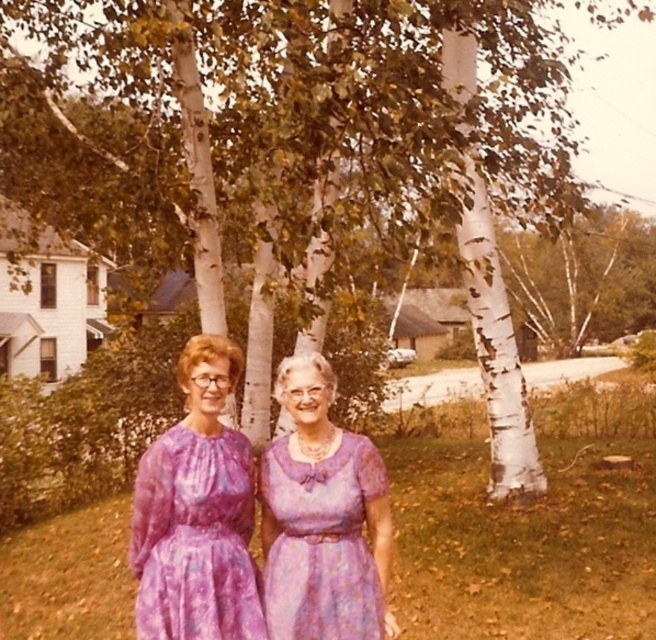
You are taking a photo of two women standing in a suburban area with birch trees. You want to focus on the point at point (x=171, y=586) and point (x=356, y=596). Which point is closer to the camera?

Point (x=171, y=586) is closer to the camera than point (x=356, y=596).